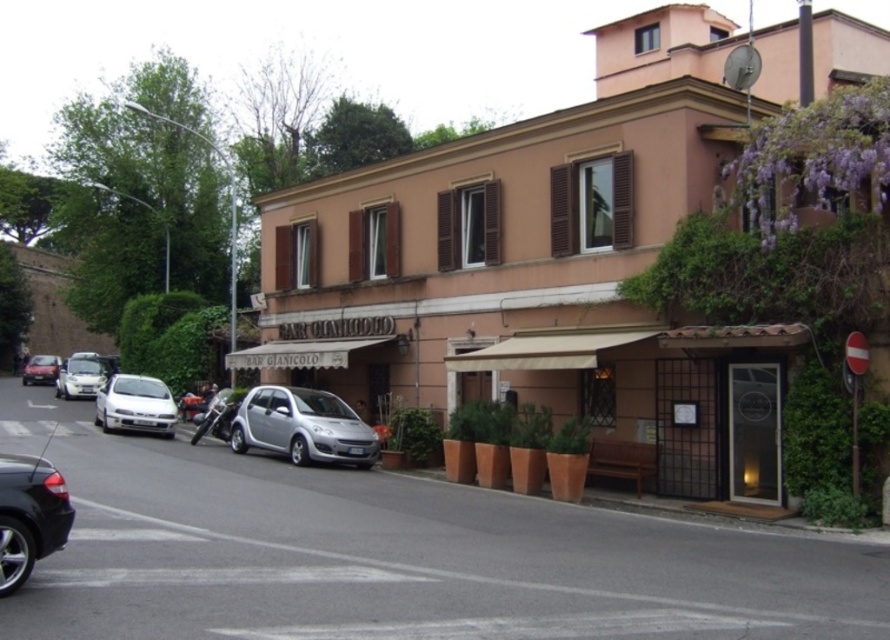
You are a delivery person who needs to park your vehicle in the street scene. The shiny black sedan at lower left and the matte silver car at left are already parked. Your van is 5 meters long. Can you park your van between these two cars without overlapping them?

The shiny black sedan at lower left is smaller than the matte silver car at left, but without knowing the exact distance between them, it is impossible to determine if there is enough space for a 5 meter long van. Please check the actual distance between the two cars first.